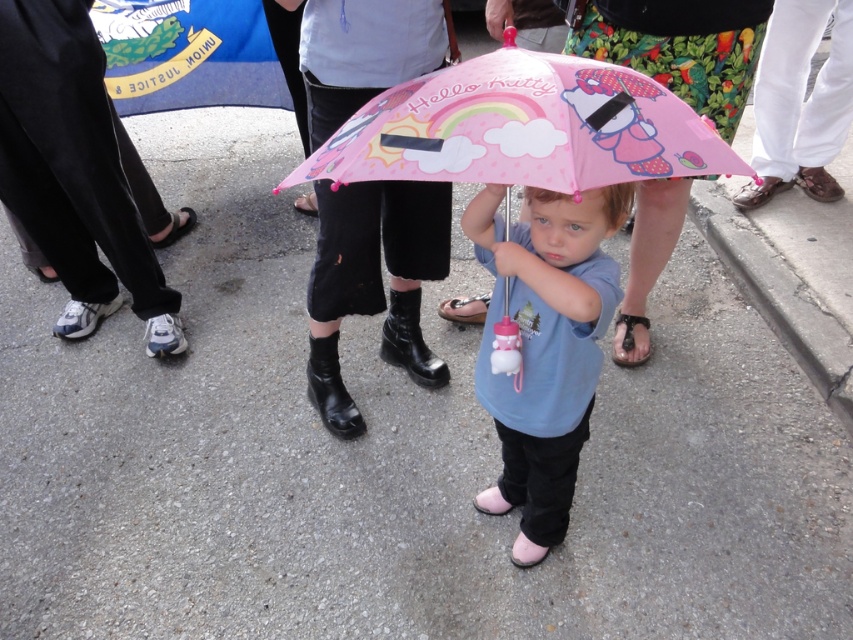
Is point (537, 301) positioned behind point (624, 336)?

That is False.

Is matte pink umbrella at center closer to the viewer compared to black leather sandal at lower center?

Yes.

Is point (492, 257) in front of point (616, 317)?

Yes, it is.

Locate an element on the screen. Image resolution: width=853 pixels, height=640 pixels. matte pink umbrella at center is located at coordinates 544,348.

Which of these two, pink matte umbrella at center or matte pink umbrella at center, stands shorter?

pink matte umbrella at center

Looking at this image, which is above, pink matte umbrella at center or matte pink umbrella at center?

pink matte umbrella at center

Is point (480, 92) less distant than point (535, 294)?

Yes, point (480, 92) is closer to viewer.

Find the location of a particular element. The image size is (853, 640). pink matte umbrella at center is located at coordinates (523, 129).

Describe the element at coordinates (523, 129) in the screenshot. The image size is (853, 640). I see `pink matte umbrella at center` at that location.

From the picture: Can you confirm if pink matte umbrella at center is positioned above pink leather sandal at center?

Correct, pink matte umbrella at center is located above pink leather sandal at center.

From the picture: Who is more forward, [677,157] or [447,307]?

Point [677,157] is more forward.

I want to click on pink matte umbrella at center, so click(x=523, y=129).